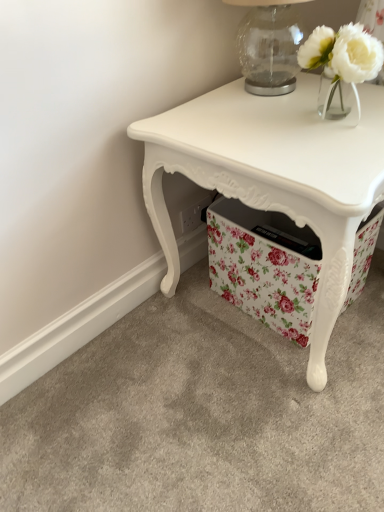
You are a GUI agent. You are given a task and a screenshot of the screen. Output one action in this format:
    pyautogui.click(x=<x>, y=<y>)
    Task: Click on the vacant region in front of transparent glass table lamp at upper right
    
    Given the screenshot: What is the action you would take?
    pyautogui.click(x=261, y=120)